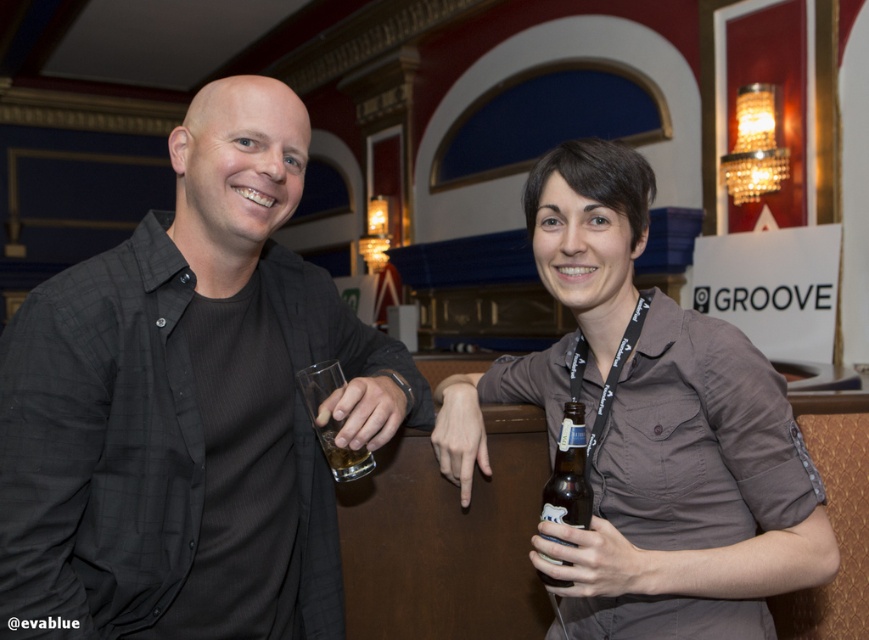
Question: From the image, what is the correct spatial relationship of matte brown shirt at center in relation to translucent glass at hand left?

Choices:
 (A) right
 (B) left

Answer: (A)

Question: Can you confirm if matte brown shirt at center is positioned to the right of brown glass bottle at lower center?

Choices:
 (A) no
 (B) yes

Answer: (B)

Question: Which point appears closest to the camera in this image?

Choices:
 (A) pyautogui.click(x=569, y=424)
 (B) pyautogui.click(x=332, y=392)

Answer: (A)

Question: Is matte black shirt at center wider than brown glass bottle at lower center?

Choices:
 (A) yes
 (B) no

Answer: (A)

Question: Which object is farther from the camera taking this photo?

Choices:
 (A) brown glass bottle at lower center
 (B) translucent glass at hand left
 (C) matte black shirt at center

Answer: (B)

Question: Which of the following is the farthest from the observer?

Choices:
 (A) translucent glass at hand left
 (B) brown glass bottle at lower center

Answer: (A)